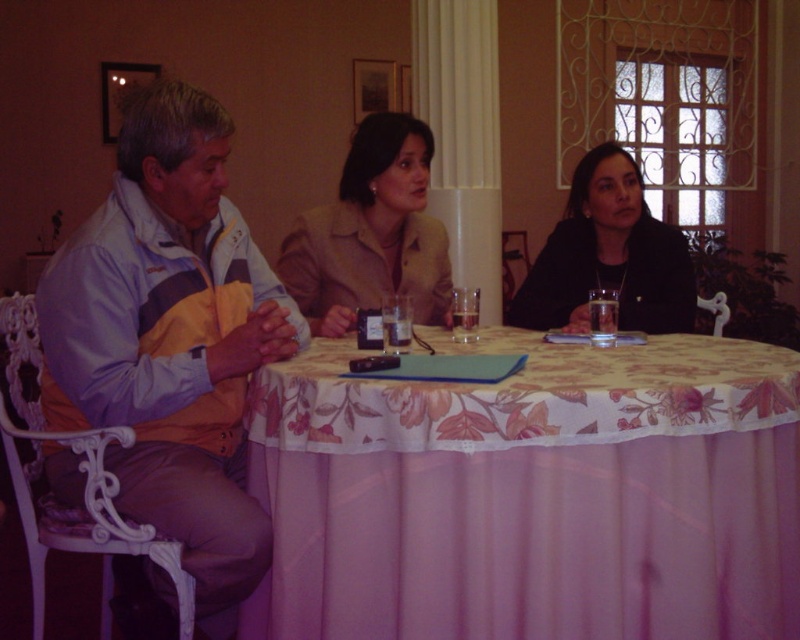
Who is more distant from viewer, (600, 374) or (612, 198)?

The point (612, 198) is behind.

Which is above, floral fabric tablecloth at center or black matte jacket at upper right?

black matte jacket at upper right is higher up.

This screenshot has height=640, width=800. I want to click on floral fabric tablecloth at center, so click(532, 496).

Does beige fabric jacket at center appear on the left side of black matte jacket at upper right?

Indeed, beige fabric jacket at center is positioned on the left side of black matte jacket at upper right.

What do you see at coordinates (372, 234) in the screenshot?
I see `beige fabric jacket at center` at bounding box center [372, 234].

Find the location of `beige fabric jacket at center`. beige fabric jacket at center is located at coordinates (372, 234).

Identify the location of beige fabric jacket at center. The width and height of the screenshot is (800, 640). [x=372, y=234].

Does floral fabric tablecloth at center lie behind light blue and yellow jacket at left?

That is False.

Is floral fabric tablecloth at center smaller than light blue and yellow jacket at left?

No, floral fabric tablecloth at center is not smaller than light blue and yellow jacket at left.

Is point (514, 444) positioned before point (204, 180)?

Yes, it is.

Locate an element on the screen. This screenshot has width=800, height=640. floral fabric tablecloth at center is located at coordinates (532, 496).